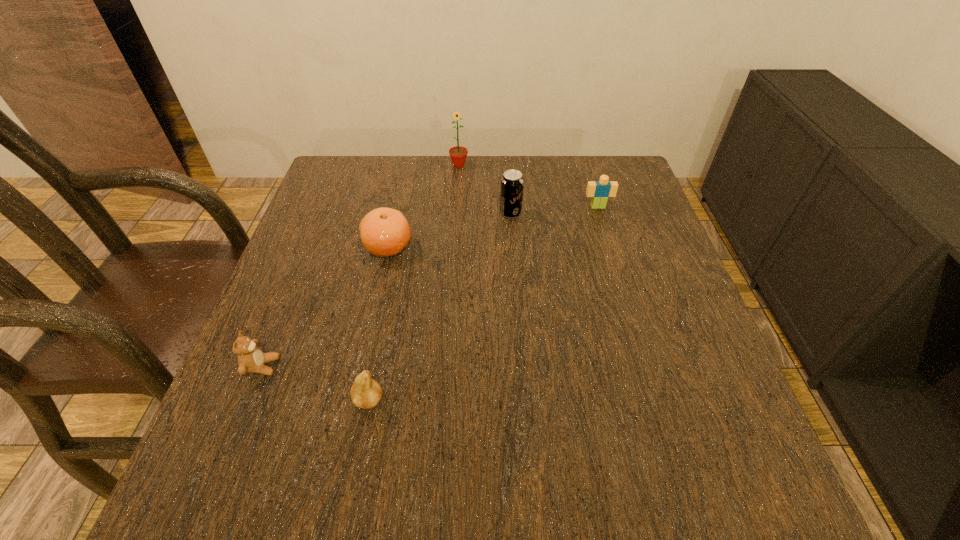
Find the location of a particular element. free space in the image that satisfies the following two spatial constraints: 1. on the face of the rightmost object; 2. on the front-facing side of the leftmost object is located at coordinates (646, 366).

This screenshot has width=960, height=540. I want to click on blank space that satisfies the following two spatial constraints: 1. on the face of the soda can; 2. on the right side of the tallest object, so click(456, 213).